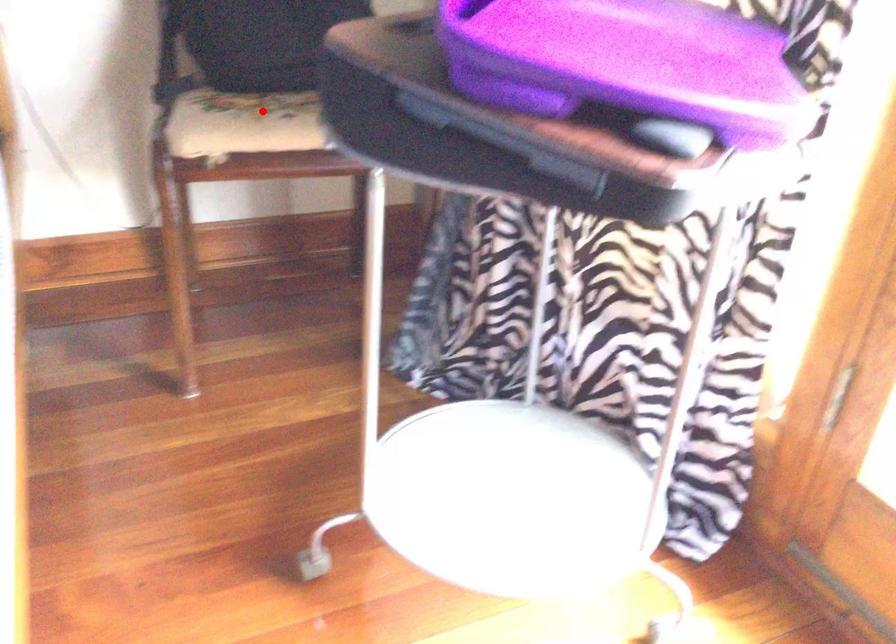
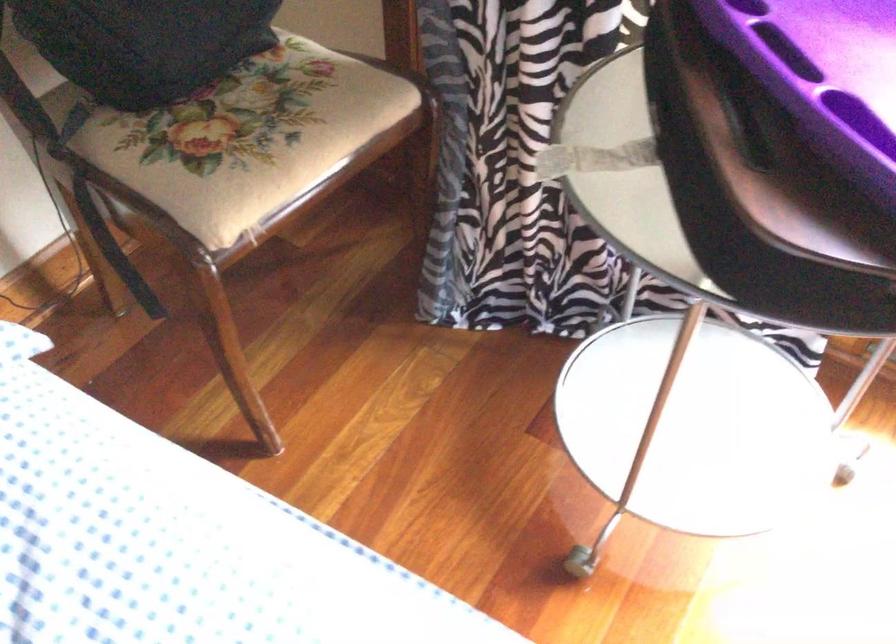
Question: I am providing you with two images of the same scene from different viewpoints. Image1 has a red point marked. In image2, the corresponding 3D location appears at what relative position? Reply with the corresponding letter.

Choices:
 (A) Closer
 (B) Farther

Answer: (A)